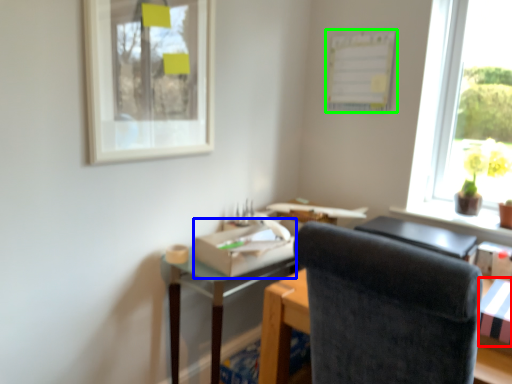
Question: Which is nearer to the cardboard box (highlighted by a red box)? cardboard box (highlighted by a blue box) or bulletin board (highlighted by a green box).

Choices:
 (A) cardboard box
 (B) bulletin board

Answer: (A)